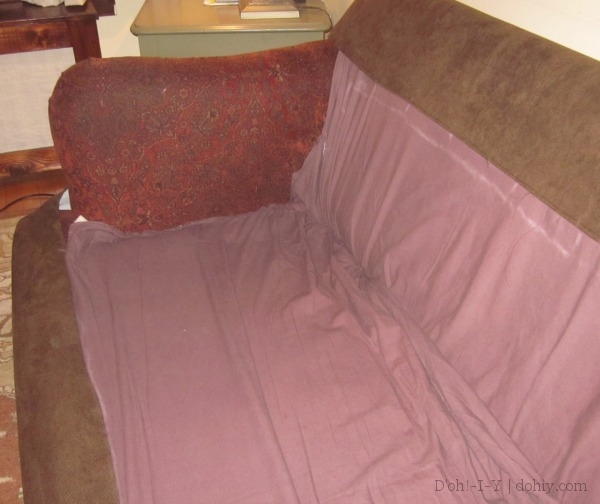
The width and height of the screenshot is (600, 504). In order to click on side table in this screenshot , I will do `click(21, 32)`.